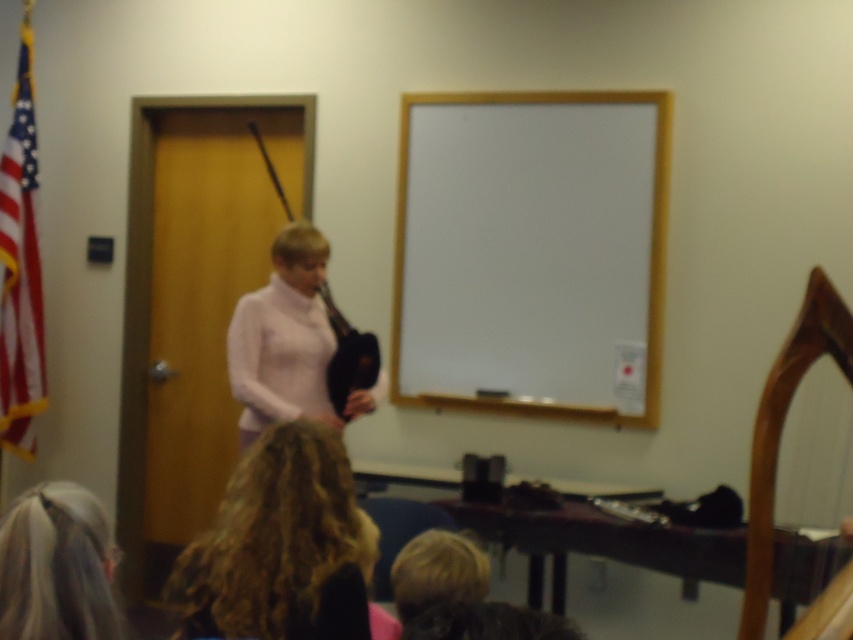
Can you confirm if matte black bagpipe at center is taller than blonde hair at lower left?

Yes.

Measure the distance between matte black bagpipe at center and blonde hair at lower left.

A distance of 1.77 meters exists between matte black bagpipe at center and blonde hair at lower left.

Does point (242, 364) come behind point (84, 561)?

Yes, it is.

Locate an element on the screen. The image size is (853, 640). matte black bagpipe at center is located at coordinates (283, 339).

Looking at this image, is white matte board at center below blonde hair at lower center?

No, white matte board at center is not below blonde hair at lower center.

Does point (463, 259) lie in front of point (271, 444)?

No, it is not.

Does point (531, 93) come behind point (271, 579)?

Yes, point (531, 93) is behind point (271, 579).

You are a GUI agent. You are given a task and a screenshot of the screen. Output one action in this format:
    pyautogui.click(x=<x>, y=<y>)
    Task: Click on the white matte board at center
    Image resolution: width=853 pixels, height=640 pixels.
    Given the screenshot: What is the action you would take?
    pyautogui.click(x=531, y=253)

Does white matte board at center have a larger size compared to matte black bagpipe at center?

Yes, white matte board at center is bigger than matte black bagpipe at center.

Based on the photo, can you confirm if white matte board at center is positioned below matte black bagpipe at center?

Actually, white matte board at center is above matte black bagpipe at center.

I want to click on white matte board at center, so click(x=531, y=253).

I want to click on white matte board at center, so click(x=531, y=253).